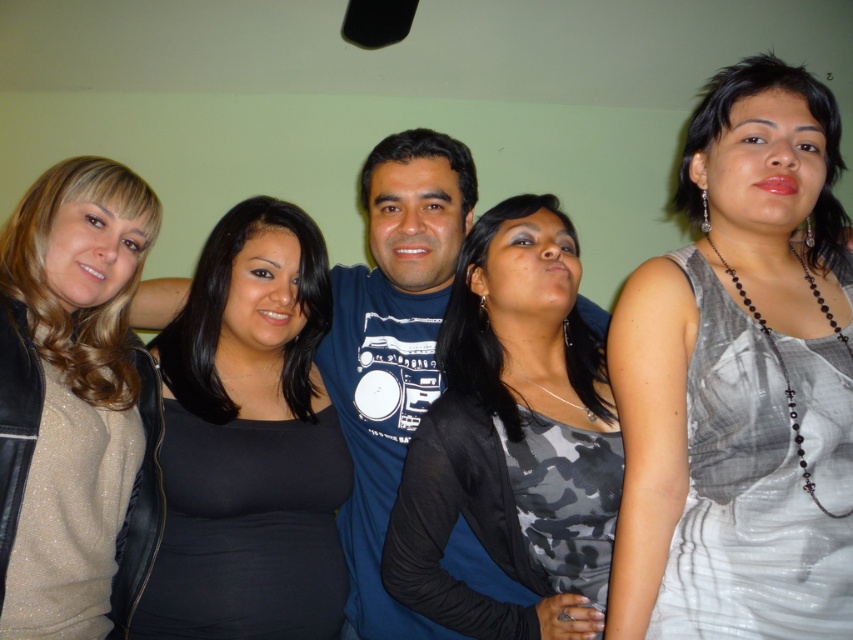
Question: Which of the following is the farthest from the observer?

Choices:
 (A) sparkly beige sweater at left
 (B) gray textured dress at center
 (C) blue cotton shirt at center
 (D) black matte shirt at center

Answer: (C)

Question: Which of the following is the farthest from the observer?

Choices:
 (A) (776, 93)
 (B) (299, 417)
 (C) (537, 276)

Answer: (B)

Question: Is black matte shirt at center bigger than sparkly beige sweater at left?

Choices:
 (A) no
 (B) yes

Answer: (B)

Question: Among these objects, which one is nearest to the camera?

Choices:
 (A) black matte shirt at center
 (B) gray textured dress at center
 (C) sparkly beige sweater at left

Answer: (B)

Question: Does gray textured dress at center lie behind sparkly beige sweater at left?

Choices:
 (A) yes
 (B) no

Answer: (B)

Question: Is black matte shirt at center below sparkly beige sweater at left?

Choices:
 (A) no
 (B) yes

Answer: (B)